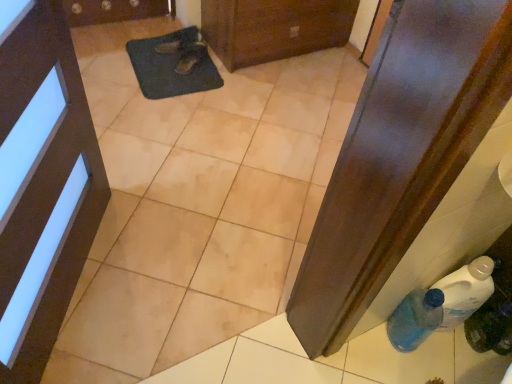
Identify the location of free space to the right of brown leather shoe at center, acting as the first footwear starting from the bottom. (209, 71).